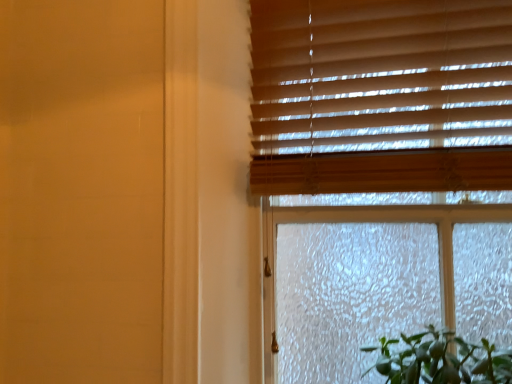
Describe the element at coordinates (380, 175) in the screenshot. The image size is (512, 384). I see `wooden blinds at upper right` at that location.

Where is `wooden blinds at upper right`? The image size is (512, 384). wooden blinds at upper right is located at coordinates (380, 175).

Describe the element at coordinates (380, 75) in the screenshot. I see `wooden blinds at upper right` at that location.

Where is `wooden blinds at upper right`? wooden blinds at upper right is located at coordinates (380, 75).

The height and width of the screenshot is (384, 512). Identify the location of wooden blinds at upper right. (380, 175).

Looking at this image, which is more to the right, wooden blinds at upper right or wooden blinds at upper right?

Positioned to the right is wooden blinds at upper right.

Relative to wooden blinds at upper right, is wooden blinds at upper right in front or behind?

Clearly, wooden blinds at upper right is behind wooden blinds at upper right.

Is point (404, 40) closer to viewer compared to point (500, 233)?

No, (404, 40) is further to viewer.

From the image's perspective, would you say wooden blinds at upper right is shown under wooden blinds at upper right?

No, from the image's perspective, wooden blinds at upper right is not beneath wooden blinds at upper right.

Consider the image. From a real-world perspective, does wooden blinds at upper right sit lower than wooden blinds at upper right?

Incorrect, from a real-world perspective, wooden blinds at upper right is higher than wooden blinds at upper right.

Is wooden blinds at upper right wider or thinner than wooden blinds at upper right?

Considering their sizes, wooden blinds at upper right looks slimmer than wooden blinds at upper right.

Is wooden blinds at upper right shorter than wooden blinds at upper right?

Yes, wooden blinds at upper right is shorter than wooden blinds at upper right.

Considering the sizes of wooden blinds at upper right and wooden blinds at upper right in the image, is wooden blinds at upper right bigger or smaller than wooden blinds at upper right?

In the image, wooden blinds at upper right appears to be smaller than wooden blinds at upper right.

Is wooden blinds at upper right outside of wooden blinds at upper right?

No, most part of wooden blinds at upper right lies within wooden blinds at upper right.

Would you say wooden blinds at upper right is a long distance from wooden blinds at upper right?

No, wooden blinds at upper right is not far from wooden blinds at upper right.

Is wooden blinds at upper right oriented towards wooden blinds at upper right?

Yes, wooden blinds at upper right is aimed at wooden blinds at upper right.

At what (x,y) coordinates should I click in order to perform the action: click on blind that appears above the wooden blinds at upper right (from the image's perspective). Please return your answer as a coordinate pair (x, y). Looking at the image, I should click on (380, 75).

Between wooden blinds at upper right and wooden blinds at upper right, which one appears on the left side from the viewer's perspective?

From the viewer's perspective, wooden blinds at upper right appears more on the left side.

Is wooden blinds at upper right in front of wooden blinds at upper right?

Yes, wooden blinds at upper right is closer to the viewer.

Is point (387, 321) closer to viewer compared to point (375, 88)?

No, (387, 321) is further to viewer.

From the image's perspective, which is above, wooden blinds at upper right or wooden blinds at upper right?

wooden blinds at upper right, from the image's perspective.

From a real-world perspective, is wooden blinds at upper right positioned under wooden blinds at upper right based on gravity?

Indeed, from a real-world perspective, wooden blinds at upper right is positioned beneath wooden blinds at upper right.

Considering the relative sizes of wooden blinds at upper right and wooden blinds at upper right in the image provided, is wooden blinds at upper right wider than wooden blinds at upper right?

Correct, the width of wooden blinds at upper right exceeds that of wooden blinds at upper right.

Does wooden blinds at upper right have a lesser height compared to wooden blinds at upper right?

Incorrect, the height of wooden blinds at upper right does not fall short of that of wooden blinds at upper right.

Who is bigger, wooden blinds at upper right or wooden blinds at upper right?

wooden blinds at upper right is bigger.

Is wooden blinds at upper right located outside wooden blinds at upper right?

wooden blinds at upper right lies outside wooden blinds at upper right's area.

Is wooden blinds at upper right next to wooden blinds at upper right?

Yes, wooden blinds at upper right is next to wooden blinds at upper right.

Is wooden blinds at upper right facing away from wooden blinds at upper right?

Correct, wooden blinds at upper right is looking away from wooden blinds at upper right.

Identify the location of window lying in front of the wooden blinds at upper right. The image size is (512, 384). (380, 175).

Locate an element on the screen. The width and height of the screenshot is (512, 384). blind above the wooden blinds at upper right (from a real-world perspective) is located at coordinates (380, 75).

Find the location of a particular element. window lying in front of the wooden blinds at upper right is located at coordinates (380, 175).